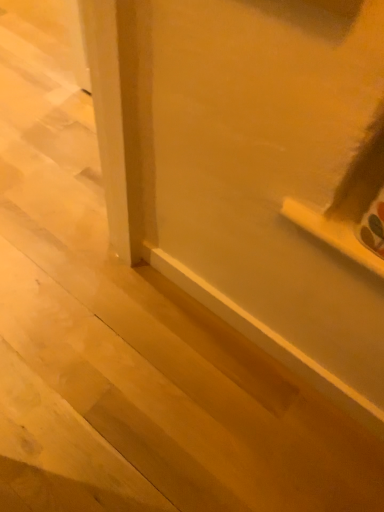
This screenshot has height=512, width=384. Find the location of `white glossy window sill at lower right`. white glossy window sill at lower right is located at coordinates (332, 234).

What do you see at coordinates (332, 234) in the screenshot?
I see `white glossy window sill at lower right` at bounding box center [332, 234].

Locate an element on the screen. The width and height of the screenshot is (384, 512). white glossy window sill at lower right is located at coordinates (332, 234).